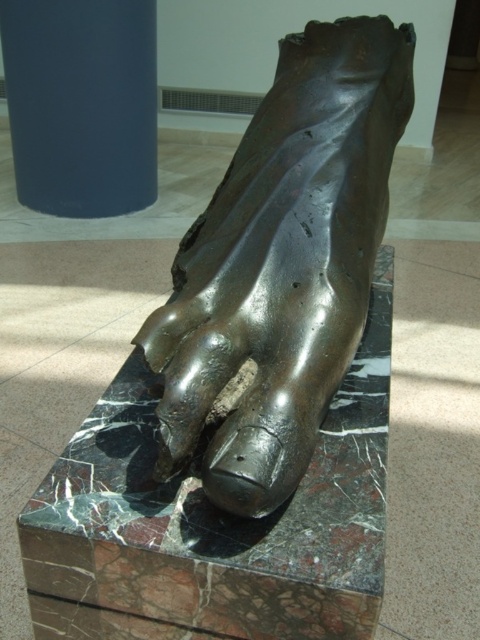
Consider the image. Does shiny bronze foot at center come behind blue matte cylinder at upper left?

No, shiny bronze foot at center is in front of blue matte cylinder at upper left.

Find the location of a particular element. shiny bronze foot at center is located at coordinates (283, 260).

Find the location of `shiny bronze foot at center`. shiny bronze foot at center is located at coordinates (283, 260).